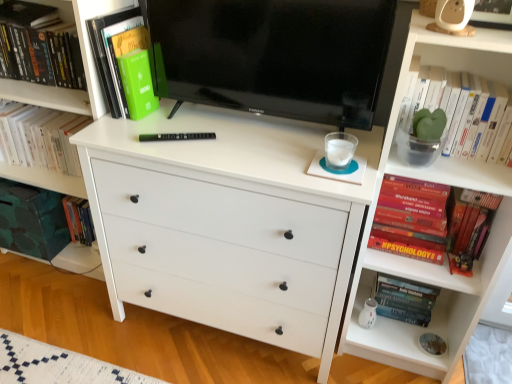
What is the approximate height of beige plastic toy at upper right?

5.76 inches.

In order to face red matte book at right, which is counted as the second book, starting from the right, should I rotate leftwards or rightwards?

You should look right and rotate roughly 22.665 degrees.

The width and height of the screenshot is (512, 384). Find the location of `green matte book at upper left, arranged as the fourth book when viewed from the right`. green matte book at upper left, arranged as the fourth book when viewed from the right is located at coordinates (117, 52).

The width and height of the screenshot is (512, 384). Find the location of `white matte chest of drawers at center`. white matte chest of drawers at center is located at coordinates (227, 223).

Describe the element at coordinates (227, 223) in the screenshot. I see `white matte chest of drawers at center` at that location.

The image size is (512, 384). What are the coordinates of `black glossy tv at center` in the screenshot? It's located at (279, 55).

Locate an element on the screen. green matte book at upper left, the first book positioned from the left is located at coordinates (39, 46).

Locate an element on the screen. Image resolution: width=512 pixels, height=384 pixels. beige plastic toy at upper right is located at coordinates (453, 17).

Considering the sizes of green matte plant at upper right, the 1th book positioned from the right, and red matte book at right, which is counted as the second book, starting from the right, in the image, is green matte plant at upper right, the 1th book positioned from the right, taller or shorter than red matte book at right, which is counted as the second book, starting from the right,?

In the image, green matte plant at upper right, the 1th book positioned from the right, appears to be shorter than red matte book at right, which is counted as the second book, starting from the right.

From the picture: How many degrees apart are the facing directions of green matte plant at upper right, the 1th book positioned from the right, and red matte book at right, arranged as the 4th book when viewed from the left?

The angular difference between green matte plant at upper right, the 1th book positioned from the right, and red matte book at right, arranged as the 4th book when viewed from the left, is 0.00125 degrees.

Between green matte plant at upper right, marked as the 5th book in a left-to-right arrangement, and red matte book at right, arranged as the 4th book when viewed from the left, which one appears on the right side from the viewer's perspective?

green matte plant at upper right, marked as the 5th book in a left-to-right arrangement, is more to the right.

Based on the photo, is the depth of green matte plant at upper right, marked as the 5th book in a left-to-right arrangement, greater than that of red matte book at right, arranged as the 4th book when viewed from the left?

No, it is in front of red matte book at right, arranged as the 4th book when viewed from the left.

Who is taller, hardcover psychology book at lower right, which is the 3th book in left-to-right order, or green matte plant at upper right, marked as the 5th book in a left-to-right arrangement?

Standing taller between the two is hardcover psychology book at lower right, which is the 3th book in left-to-right order.

Considering the positions of objects hardcover psychology book at lower right, placed as the third book when sorted from right to left, and green matte plant at upper right, marked as the 5th book in a left-to-right arrangement, in the image provided, who is behind, hardcover psychology book at lower right, placed as the third book when sorted from right to left, or green matte plant at upper right, marked as the 5th book in a left-to-right arrangement,?

hardcover psychology book at lower right, placed as the third book when sorted from right to left.

Is point (432, 300) behind point (429, 153)?

That is True.

Do you think hardcover psychology book at lower right, placed as the third book when sorted from right to left, is within green matte plant at upper right, marked as the 5th book in a left-to-right arrangement, or outside of it?

hardcover psychology book at lower right, placed as the third book when sorted from right to left, is not enclosed by green matte plant at upper right, marked as the 5th book in a left-to-right arrangement.

Can you confirm if white matte chest of drawers at center is bigger than red matte book at right, arranged as the 4th book when viewed from the left?

Yes.

Which of these two, white matte chest of drawers at center or red matte book at right, which is counted as the second book, starting from the right, is wider?

white matte chest of drawers at center.

Is white matte chest of drawers at center facing away from red matte book at right, which is counted as the second book, starting from the right?

No, white matte chest of drawers at center is not facing away from red matte book at right, which is counted as the second book, starting from the right.

Is white matte chest of drawers at center far away from red matte book at right, which is counted as the second book, starting from the right?

No, white matte chest of drawers at center is not far away from red matte book at right, which is counted as the second book, starting from the right.

Is the depth of green matte book at upper left, positioned as the 2th book in left-to-right order, greater than that of green matte book at upper left, the first book positioned from the left?

No, green matte book at upper left, positioned as the 2th book in left-to-right order, is closer to the viewer.

From a real-world perspective, is green matte book at upper left, arranged as the fourth book when viewed from the right, physically above green matte book at upper left, the first book positioned from the left?

Yes.

Does point (106, 21) come closer to viewer compared to point (64, 43)?

Yes, it is in front of point (64, 43).

Is green matte book at upper left, arranged as the fourth book when viewed from the right, positioned far away from green matte book at upper left, the first book positioned from the left?

That's not correct — green matte book at upper left, arranged as the fourth book when viewed from the right, is a little close to green matte book at upper left, the first book positioned from the left.

Considering the relative sizes of red matte book at right, which is counted as the second book, starting from the right, and white matte chest of drawers at center in the image provided, is red matte book at right, which is counted as the second book, starting from the right, smaller than white matte chest of drawers at center?

Yes, red matte book at right, which is counted as the second book, starting from the right, is smaller than white matte chest of drawers at center.

Can you confirm if red matte book at right, which is counted as the second book, starting from the right, is positioned to the right of white matte chest of drawers at center?

Indeed, red matte book at right, which is counted as the second book, starting from the right, is positioned on the right side of white matte chest of drawers at center.

In the scene shown: Is red matte book at right, which is counted as the second book, starting from the right, outside of white matte chest of drawers at center?

Yes.

Based on their positions, is green matte book at upper left, the first book positioned from the left, located to the left or right of red matte book at right, arranged as the 4th book when viewed from the left?

From the image, it's evident that green matte book at upper left, the first book positioned from the left, is to the left of red matte book at right, arranged as the 4th book when viewed from the left.

Considering the relative sizes of green matte book at upper left, placed as the fifth book when sorted from right to left, and red matte book at right, arranged as the 4th book when viewed from the left, in the image provided, is green matte book at upper left, placed as the fifth book when sorted from right to left, wider than red matte book at right, arranged as the 4th book when viewed from the left,?

Incorrect, the width of green matte book at upper left, placed as the fifth book when sorted from right to left, does not surpass that of red matte book at right, arranged as the 4th book when viewed from the left.

From the image's perspective, is green matte book at upper left, the first book positioned from the left, on top of red matte book at right, arranged as the 4th book when viewed from the left?

Indeed, from the image's perspective, green matte book at upper left, the first book positioned from the left, is shown above red matte book at right, arranged as the 4th book when viewed from the left.

Looking at this image, is black glossy tv at center spatially inside hardcover psychology book at lower right, placed as the third book when sorted from right to left, or outside of it?

black glossy tv at center is located beyond the bounds of hardcover psychology book at lower right, placed as the third book when sorted from right to left.

From the image's perspective, which one is positioned lower, black glossy tv at center or hardcover psychology book at lower right, which is the 3th book in left-to-right order?

hardcover psychology book at lower right, which is the 3th book in left-to-right order.

What's the angular difference between black glossy tv at center and hardcover psychology book at lower right, placed as the third book when sorted from right to left,'s facing directions?

The angle between the facing direction of black glossy tv at center and the facing direction of hardcover psychology book at lower right, placed as the third book when sorted from right to left, is 3.65 degrees.

What are the coordinates of `book that is the 1st object above the red matte book at right, which is counted as the second book, starting from the right (from a real-world perspective)` in the screenshot? It's located at (441, 110).

There is a hardcover psychology book at lower right, which is the 3th book in left-to-right order. Identify the location of the 2nd book above it (from the image's perspective). (441, 110).

Based on the photo, estimate the real-world distances between objects in this image. Which object is further from green matte book at upper left, the first book positioned from the left, black glossy tv at center or hardcover psychology book at lower right, which is the 3th book in left-to-right order?

The object further to green matte book at upper left, the first book positioned from the left, is hardcover psychology book at lower right, which is the 3th book in left-to-right order.

Considering their positions, is green matte plant at upper right, the 1th book positioned from the right, positioned closer to red matte book at right, arranged as the 4th book when viewed from the left, than green matte book at upper left, placed as the fifth book when sorted from right to left?

Based on the image, green matte plant at upper right, the 1th book positioned from the right, appears to be nearer to red matte book at right, arranged as the 4th book when viewed from the left.

In the scene shown: Which object lies nearer to the anchor point beige plastic toy at upper right, green matte plant at upper right, marked as the 5th book in a left-to-right arrangement, or white matte chest of drawers at center?

green matte plant at upper right, marked as the 5th book in a left-to-right arrangement.

Based on their spatial positions, is red matte book at right, which is counted as the second book, starting from the right, or white matte chest of drawers at center closer to black glossy tv at center?

The object closer to black glossy tv at center is white matte chest of drawers at center.

In the scene shown: Which object lies nearer to the anchor point white matte chest of drawers at center, green matte book at upper left, arranged as the fourth book when viewed from the right, or black glossy tv at center?

black glossy tv at center.

When comparing their distances from green matte book at upper left, placed as the fifth book when sorted from right to left, does hardcover psychology book at lower right, which is the 3th book in left-to-right order, or green matte book at upper left, positioned as the 2th book in left-to-right order, seem closer?

Based on the image, green matte book at upper left, positioned as the 2th book in left-to-right order, appears to be nearer to green matte book at upper left, placed as the fifth book when sorted from right to left.

Considering their positions, is green matte book at upper left, the first book positioned from the left, positioned further to green matte book at upper left, arranged as the fourth book when viewed from the right, than white matte chest of drawers at center?

white matte chest of drawers at center.

Which object lies further to the anchor point white matte chest of drawers at center, green matte plant at upper right, the 1th book positioned from the right, or black glossy tv at center?

green matte plant at upper right, the 1th book positioned from the right, lies further to white matte chest of drawers at center than the other object.

Identify the location of television between beige plastic toy at upper right and white matte chest of drawers at center from top to bottom. This screenshot has width=512, height=384. (x=279, y=55).

The image size is (512, 384). Identify the location of book between white matte chest of drawers at center and red matte book at right, arranged as the 4th book when viewed from the left, from left to right. tap(403, 300).

What are the coordinates of `toy between black glossy tv at center and green matte plant at upper right, marked as the 5th book in a left-to-right arrangement, from left to right` in the screenshot? It's located at (453, 17).

Find the location of a particular element. The image size is (512, 384). the chest of drawers that lies between beige plastic toy at upper right and hardcover psychology book at lower right, which is the 3th book in left-to-right order, from top to bottom is located at coordinates (227, 223).